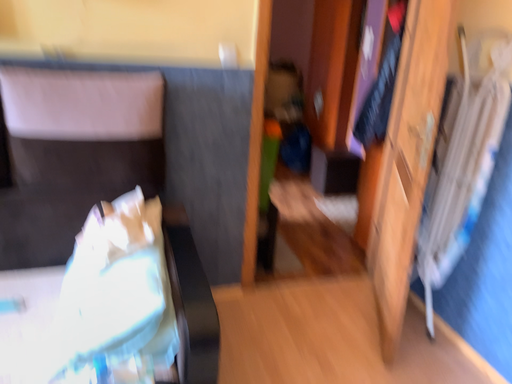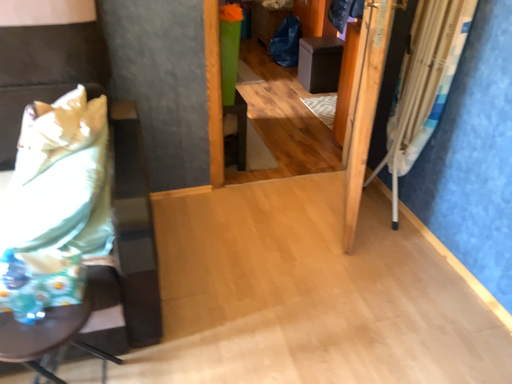
Question: How did the camera likely rotate when shooting the video?

Choices:
 (A) rotated downward
 (B) rotated upward

Answer: (A)